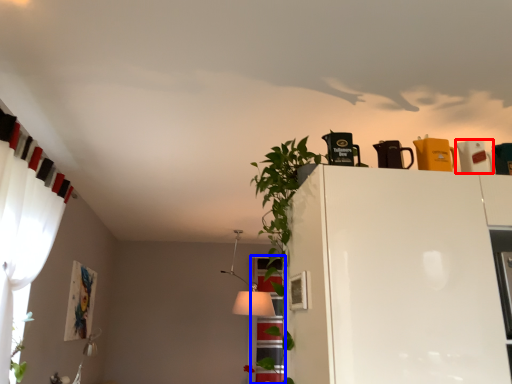
Question: Which of the following is the closest to the observer, appliance (highlighted by a red box) or window (highlighted by a blue box)?

Choices:
 (A) appliance
 (B) window

Answer: (A)